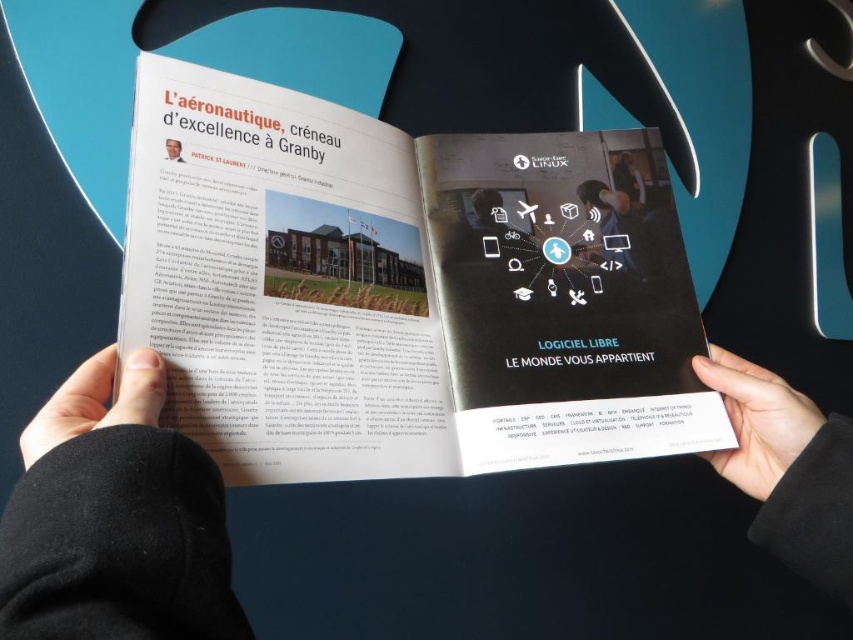
Question: Which of the following is the farthest from the observer?

Choices:
 (A) white paper at lower right
 (B) white matte paper at lower left
 (C) matte black magazine at center
 (D) smooth skin face at upper left

Answer: (A)

Question: Which object appears closest to the camera in this image?

Choices:
 (A) white matte paper at lower left
 (B) white paper at lower right
 (C) matte black magazine at center
 (D) smooth skin face at upper left

Answer: (A)

Question: Among these points, which one is nearest to the camera?

Choices:
 (A) coord(280,152)
 (B) coord(91,360)
 (C) coord(172,147)
 (D) coord(722,458)

Answer: (B)

Question: Is white paper at lower right thinner than white matte paper at lower left?

Choices:
 (A) no
 (B) yes

Answer: (A)

Question: Does matte black magazine at center come behind black fabric hands at center?

Choices:
 (A) yes
 (B) no

Answer: (A)

Question: Can you confirm if black fabric hands at center is wider than white matte paper at lower left?

Choices:
 (A) yes
 (B) no

Answer: (A)